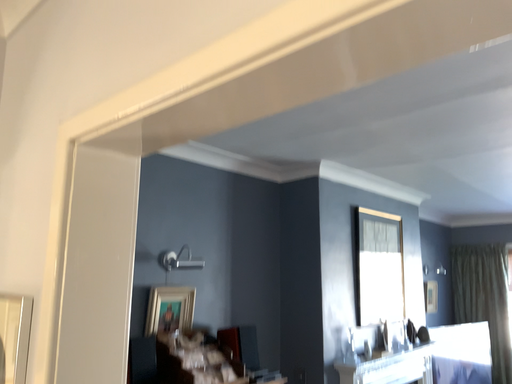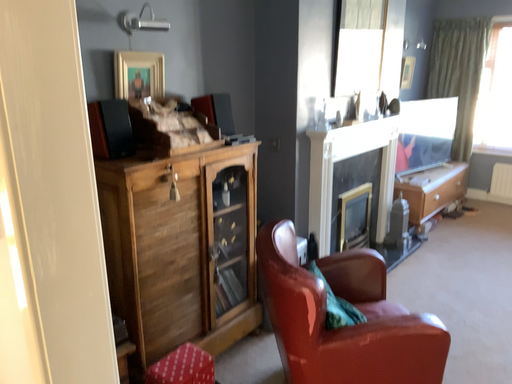
Question: How did the camera likely rotate when shooting the video?

Choices:
 (A) rotated upward
 (B) rotated downward

Answer: (B)